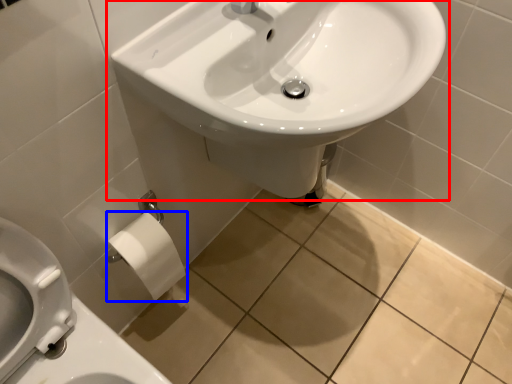
Question: Which object is closer to the camera taking this photo, sink (highlighted by a red box) or toilet paper (highlighted by a blue box)?

Choices:
 (A) sink
 (B) toilet paper

Answer: (A)